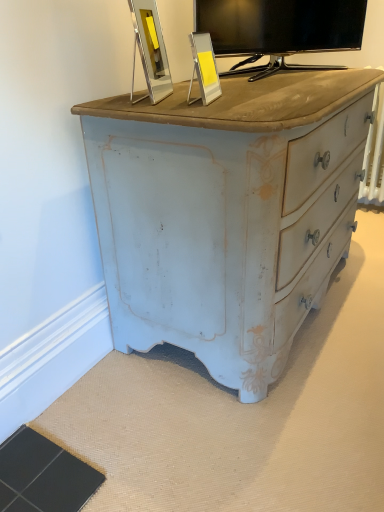
Question: From the image's perspective, is matte black tv at upper center on top of silver metallic picture frame at upper center, the 2th picture frame from the right?

Choices:
 (A) yes
 (B) no

Answer: (A)

Question: Is the position of matte black tv at upper center more distant than that of silver metallic picture frame at upper center, which is the first picture frame from left to right?

Choices:
 (A) yes
 (B) no

Answer: (A)

Question: Considering the relative sizes of matte black tv at upper center and silver metallic picture frame at upper center, which is the first picture frame from left to right, in the image provided, is matte black tv at upper center thinner than silver metallic picture frame at upper center, which is the first picture frame from left to right,?

Choices:
 (A) yes
 (B) no

Answer: (B)

Question: Is matte black tv at upper center not inside silver metallic picture frame at upper center, which is the first picture frame from left to right?

Choices:
 (A) yes
 (B) no

Answer: (A)

Question: Can you confirm if matte black tv at upper center is wider than silver metallic picture frame at upper center, the 2th picture frame from the right?

Choices:
 (A) no
 (B) yes

Answer: (B)

Question: Is matte black tv at upper center situated inside metallic silver picture frame at upper center, acting as the 2th picture frame starting from the left, or outside?

Choices:
 (A) inside
 (B) outside

Answer: (B)

Question: From their relative heights in the image, would you say matte black tv at upper center is taller or shorter than metallic silver picture frame at upper center, acting as the 2th picture frame starting from the left?

Choices:
 (A) tall
 (B) short

Answer: (A)

Question: In terms of size, does matte black tv at upper center appear bigger or smaller than metallic silver picture frame at upper center, acting as the 2th picture frame starting from the left?

Choices:
 (A) big
 (B) small

Answer: (A)

Question: From a real-world perspective, is matte black tv at upper center above or below metallic silver picture frame at upper center, which is the 1th picture frame from right to left?

Choices:
 (A) below
 (B) above

Answer: (B)

Question: From a real-world perspective, is metallic silver picture frame at upper center, acting as the 2th picture frame starting from the left, above or below matte black tv at upper center?

Choices:
 (A) above
 (B) below

Answer: (B)

Question: Considering the positions of point (x=195, y=39) and point (x=336, y=20), is point (x=195, y=39) closer or farther from the camera than point (x=336, y=20)?

Choices:
 (A) closer
 (B) farther

Answer: (A)

Question: From the image's perspective, relative to matte black tv at upper center, is metallic silver picture frame at upper center, acting as the 2th picture frame starting from the left, above or below?

Choices:
 (A) below
 (B) above

Answer: (A)

Question: Is metallic silver picture frame at upper center, which is the 1th picture frame from right to left, to the left or to the right of matte black tv at upper center in the image?

Choices:
 (A) right
 (B) left

Answer: (B)

Question: Considering the positions of silver metallic picture frame at upper center, which is the first picture frame from left to right, and matte black tv at upper center in the image, is silver metallic picture frame at upper center, which is the first picture frame from left to right, taller or shorter than matte black tv at upper center?

Choices:
 (A) tall
 (B) short

Answer: (B)

Question: In terms of size, does silver metallic picture frame at upper center, which is the first picture frame from left to right, appear bigger or smaller than matte black tv at upper center?

Choices:
 (A) small
 (B) big

Answer: (A)